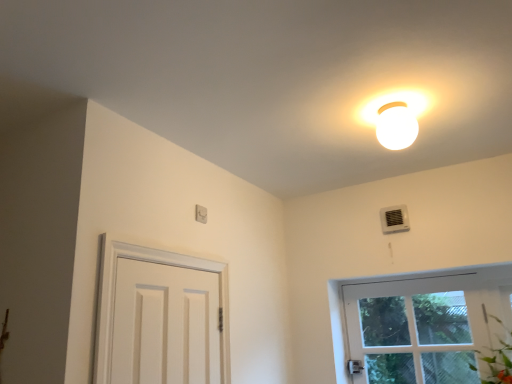
Question: Considering the relative sizes of white plastic air conditioner at upper right and white glossy light fixture at upper center in the image provided, is white plastic air conditioner at upper right taller than white glossy light fixture at upper center?

Choices:
 (A) yes
 (B) no

Answer: (B)

Question: Considering the relative sizes of white plastic air conditioner at upper right and white glossy light fixture at upper center in the image provided, is white plastic air conditioner at upper right bigger than white glossy light fixture at upper center?

Choices:
 (A) yes
 (B) no

Answer: (B)

Question: Would you say white plastic air conditioner at upper right is outside white glossy light fixture at upper center?

Choices:
 (A) no
 (B) yes

Answer: (B)

Question: Does white plastic air conditioner at upper right appear on the right side of white glossy light fixture at upper center?

Choices:
 (A) yes
 (B) no

Answer: (A)

Question: Would you say white plastic air conditioner at upper right is a long distance from white glossy light fixture at upper center?

Choices:
 (A) yes
 (B) no

Answer: (B)

Question: From a real-world perspective, is white plastic air conditioner at upper right located higher than white glossy light fixture at upper center?

Choices:
 (A) yes
 (B) no

Answer: (B)

Question: Can you confirm if white plastic air conditioner at upper right is smaller than white plastic light switch at upper center?

Choices:
 (A) no
 (B) yes

Answer: (A)

Question: Is white plastic air conditioner at upper right located outside white plastic light switch at upper center?

Choices:
 (A) yes
 (B) no

Answer: (A)

Question: Would you say white plastic light switch at upper center is part of white plastic air conditioner at upper right's contents?

Choices:
 (A) yes
 (B) no

Answer: (B)

Question: Is white plastic air conditioner at upper right positioned behind white plastic light switch at upper center?

Choices:
 (A) yes
 (B) no

Answer: (A)

Question: Can you confirm if white plastic air conditioner at upper right is taller than white plastic light switch at upper center?

Choices:
 (A) no
 (B) yes

Answer: (B)

Question: From a real-world perspective, is white plastic air conditioner at upper right physically below white plastic light switch at upper center?

Choices:
 (A) no
 (B) yes

Answer: (A)

Question: Does white plastic light switch at upper center contain white glossy light fixture at upper center?

Choices:
 (A) no
 (B) yes

Answer: (A)